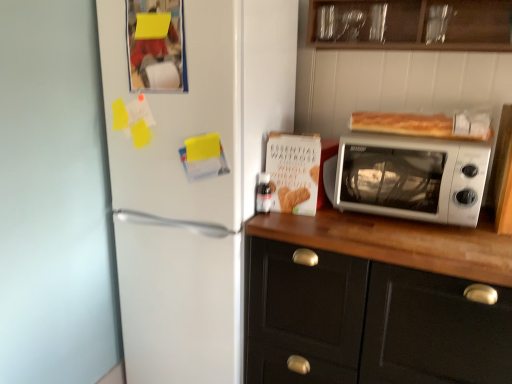
You are a GUI agent. You are given a task and a screenshot of the screen. Output one action in this format:
    pyautogui.click(x=<x>, y=<y>)
    Task: Click on the space that is in front of white plastic microwave at upper right
    The width and height of the screenshot is (512, 384).
    Given the screenshot: What is the action you would take?
    pyautogui.click(x=431, y=242)